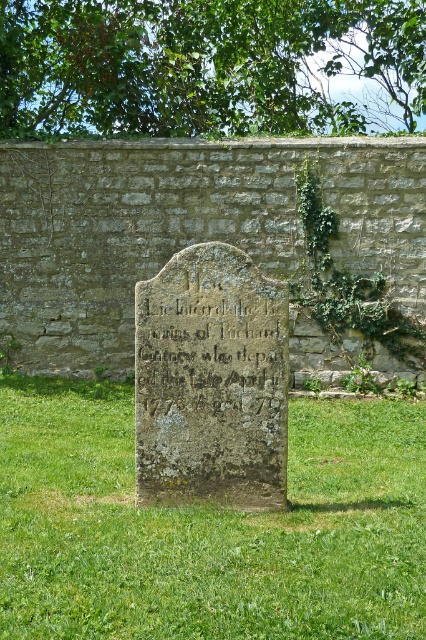
Is green leafy tree at upper center taller than carved stone inscription at center?

Indeed, green leafy tree at upper center has a greater height compared to carved stone inscription at center.

Does green leafy tree at upper center appear under carved stone inscription at center?

No, green leafy tree at upper center is not below carved stone inscription at center.

Image resolution: width=426 pixels, height=640 pixels. In order to click on green leafy tree at upper center in this screenshot , I will do `click(210, 67)`.

The height and width of the screenshot is (640, 426). What are the coordinates of `green leafy tree at upper center` in the screenshot? It's located at (210, 67).

Which is more to the left, green mossy stone at center or green mossy stone monument at center?

Positioned to the left is green mossy stone monument at center.

Is green mossy stone at center further to camera compared to green mossy stone monument at center?

That is False.

Who is more distant from viewer, [371,580] or [258,458]?

Point [258,458]

Find the location of a particular element. Image resolution: width=426 pixels, height=640 pixels. green mossy stone at center is located at coordinates (207, 528).

Can you confirm if green mossy stone at center is positioned to the right of carved stone inscription at center?

Indeed, green mossy stone at center is positioned on the right side of carved stone inscription at center.

Which is below, green mossy stone at center or carved stone inscription at center?

green mossy stone at center is lower down.

Is point (111, 480) positioned after point (189, 406)?

Yes, it is.

The width and height of the screenshot is (426, 640). I want to click on green mossy stone at center, so click(x=207, y=528).